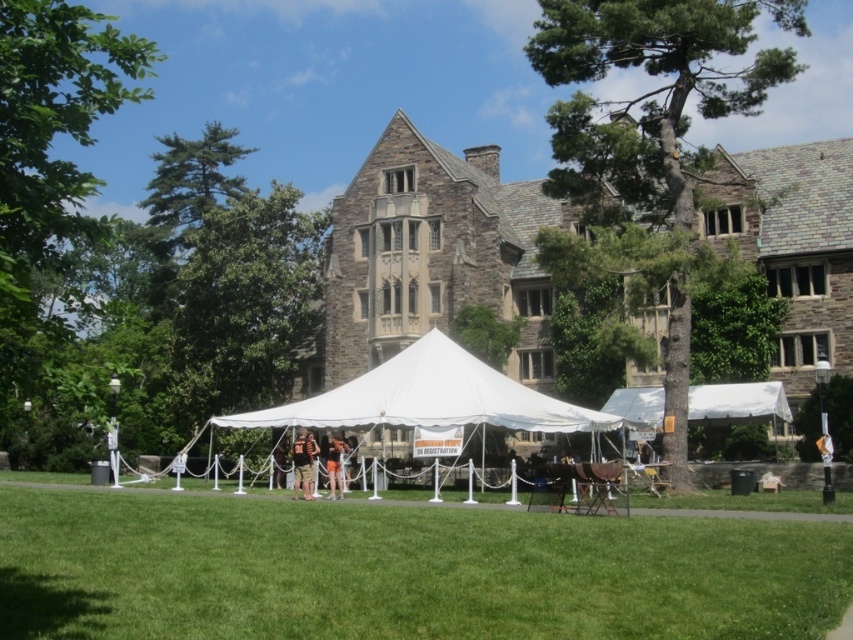
Question: Does green grass at lower center have a smaller size compared to camouflage fabric shirt at center?

Choices:
 (A) no
 (B) yes

Answer: (A)

Question: Which object is the closest to the white fabric tent at center?

Choices:
 (A) camouflage fabric shirt at center
 (B) orange fabric tent at center

Answer: (B)

Question: Which object is the closest to the green grass at lower center?

Choices:
 (A) camouflage fabric shirt at center
 (B) orange fabric tent at center
 (C) white fabric tent at center

Answer: (C)

Question: Can you confirm if green grass at lower center is positioned above white fabric tent at center?

Choices:
 (A) no
 (B) yes

Answer: (A)

Question: Is the position of camouflage fabric shirt at center less distant than that of orange fabric tent at center?

Choices:
 (A) yes
 (B) no

Answer: (A)

Question: Which object is the closest to the camouflage fabric shirt at center?

Choices:
 (A) green grass at lower center
 (B) orange fabric tent at center
 (C) white fabric tent at center

Answer: (B)